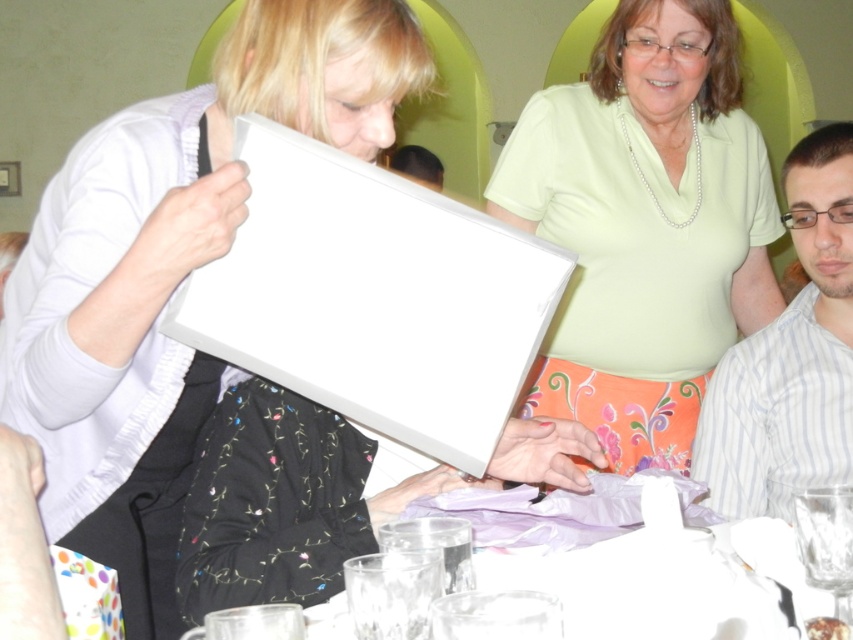
Question: Can you confirm if matte white frame at upper left is positioned above striped cotton shirt at right?

Choices:
 (A) yes
 (B) no

Answer: (B)

Question: Which object appears farthest from the camera in this image?

Choices:
 (A) matte white frame at upper left
 (B) translucent glass table at center
 (C) striped cotton shirt at right
 (D) matte white frame at center

Answer: (D)

Question: Is matte white frame at center further to the viewer compared to striped cotton shirt at right?

Choices:
 (A) yes
 (B) no

Answer: (A)

Question: Is striped cotton shirt at right to the right of translucent glass table at center from the viewer's perspective?

Choices:
 (A) no
 (B) yes

Answer: (B)

Question: Among these objects, which one is nearest to the camera?

Choices:
 (A) matte white frame at center
 (B) matte white frame at upper left

Answer: (B)

Question: Which point is farther from the camera taking this photo?

Choices:
 (A) (624, 412)
 (B) (637, 500)
 (C) (820, 461)
 (D) (183, 189)

Answer: (A)